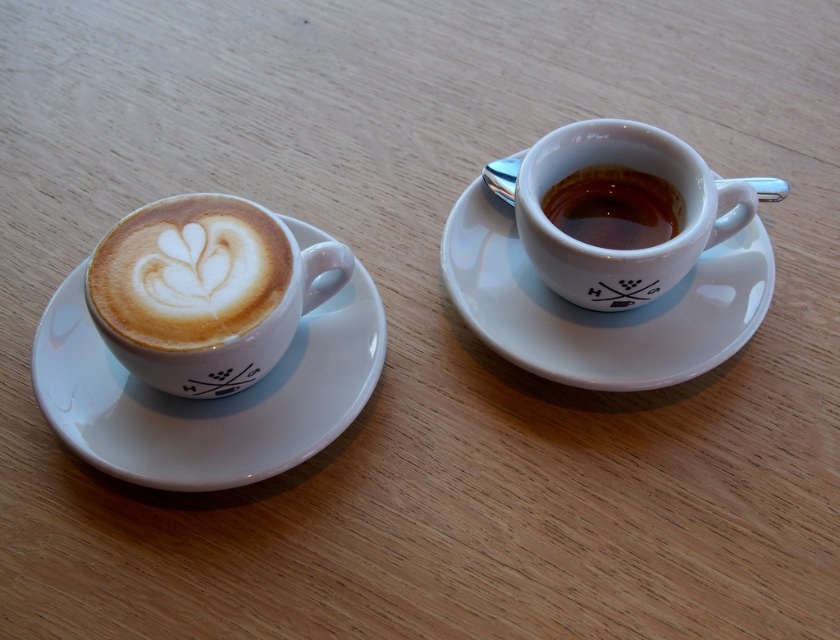
Question: Which point appears closest to the camera in this image?

Choices:
 (A) (581, 369)
 (B) (681, 257)
 (C) (229, 456)

Answer: (C)

Question: Which of the following is the farthest from the observer?

Choices:
 (A) (253, 289)
 (B) (722, 196)
 (C) (172, 444)
 (D) (654, 198)

Answer: (D)

Question: Estimate the real-world distances between objects in this image. Which object is closer to the latte art at left?

Choices:
 (A) white ceramic saucer at left
 (B) shiny ceramic espresso cup at right
 (C) white glossy saucer at right
 (D) matte ceramic espresso cup at right

Answer: (A)

Question: From the image, what is the correct spatial relationship of latte art at left in relation to shiny ceramic espresso cup at right?

Choices:
 (A) below
 (B) above

Answer: (A)

Question: Does white ceramic saucer at left come in front of shiny ceramic espresso cup at right?

Choices:
 (A) yes
 (B) no

Answer: (A)

Question: Is white ceramic saucer at left thinner than latte art at left?

Choices:
 (A) yes
 (B) no

Answer: (B)